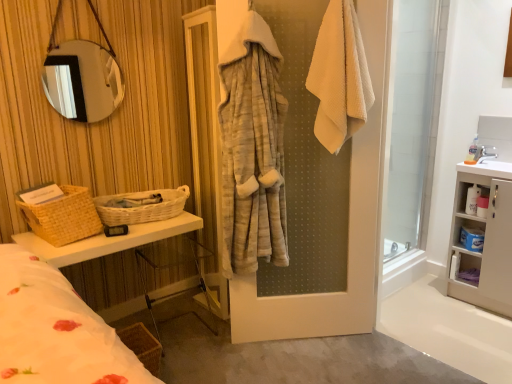
The height and width of the screenshot is (384, 512). Describe the element at coordinates (469, 235) in the screenshot. I see `blue plastic container at right, the second cabinet from the top` at that location.

Where is `white matte cabinet at right`? The height and width of the screenshot is (384, 512). white matte cabinet at right is located at coordinates (484, 239).

What do you see at coordinates (109, 240) in the screenshot? This screenshot has height=384, width=512. I see `woven wicker vanity at left` at bounding box center [109, 240].

How much space does woven beige basket at left, which appears as the third basket when viewed from the right, occupy vertically?

The height of woven beige basket at left, which appears as the third basket when viewed from the right, is 29.34 centimeters.

This screenshot has height=384, width=512. Describe the element at coordinates (83, 81) in the screenshot. I see `silver reflective mirror at upper left` at that location.

This screenshot has width=512, height=384. Describe the element at coordinates (339, 77) in the screenshot. I see `white waffle-textured towel at upper right` at that location.

Locate an element on the screen. This screenshot has width=512, height=384. blue plastic container at right, the second cabinet from the top is located at coordinates (469, 235).

Is white plastic cabinet at right, which ranks as the 1th cabinet in top-to-bottom order, with white waffle-textured towel at upper right?

No, white plastic cabinet at right, which ranks as the 1th cabinet in top-to-bottom order, is not in contact with white waffle-textured towel at upper right.

Is white plastic cabinet at right, which ranks as the 1th cabinet in top-to-bottom order, spatially inside white waffle-textured towel at upper right, or outside of it?

white plastic cabinet at right, which ranks as the 1th cabinet in top-to-bottom order, lies outside white waffle-textured towel at upper right.

Is white waffle-textured towel at upper right at the back of white plastic cabinet at right, which ranks as the 1th cabinet in top-to-bottom order?

No, white plastic cabinet at right, which ranks as the 1th cabinet in top-to-bottom order,'s orientation is not away from white waffle-textured towel at upper right.

What's the angular difference between white waffle-textured towel at upper right and white matte cabinet at right's facing directions?

The angular difference between white waffle-textured towel at upper right and white matte cabinet at right is 53.4 degrees.

Does white waffle-textured towel at upper right contain white matte cabinet at right?

No.

Which object is wider, white waffle-textured towel at upper right or white matte cabinet at right?

white matte cabinet at right is wider.

From a real-world perspective, is white waffle-textured towel at upper right beneath woven wicker vanity at left?

Incorrect, from a real-world perspective, white waffle-textured towel at upper right is higher than woven wicker vanity at left.

Considering the positions of points (359, 88) and (46, 251), is point (359, 88) closer to camera compared to point (46, 251)?

No.

The image size is (512, 384). Identify the location of bathroom cabinet below the white glossy sink at upper right (from a real-world perspective). (484, 239).

Based on their sizes in the image, would you say white glossy sink at upper right is bigger or smaller than white matte cabinet at right?

Considering their sizes, white glossy sink at upper right takes up less space than white matte cabinet at right.

Does white glossy sink at upper right lie behind white matte cabinet at right?

Yes, the depth of white glossy sink at upper right is greater than that of white matte cabinet at right.

From the image's perspective, which one is positioned higher, white glossy sink at upper right or white matte cabinet at right?

From the image's view, white glossy sink at upper right is above.

Considering the positions of point (134, 222) and point (479, 166), is point (134, 222) closer or farther from the camera than point (479, 166)?

Clearly, point (134, 222) is closer to the camera than point (479, 166).

The height and width of the screenshot is (384, 512). In order to click on the 2nd basket counting from the left of the white glossy sink at upper right in this screenshot , I will do `click(144, 208)`.

From a real-world perspective, which object stands above the other?

In real-world perspective, white glossy sink at upper right is above.

From the image's perspective, is woven wicker basket at left, which ranks as the 3th basket in bottom-to-top order, on white glossy sink at upper right?

Incorrect, from the image's perspective, woven wicker basket at left, which ranks as the 3th basket in bottom-to-top order, is lower than white glossy sink at upper right.

Considering the sizes of objects woven wicker vanity at left and silver reflective mirror at upper left in the image provided, who is thinner, woven wicker vanity at left or silver reflective mirror at upper left?

silver reflective mirror at upper left.

Which is less distant, (97, 239) or (58, 91)?

The point (97, 239) is more forward.

Is woven wicker vanity at left looking in the opposite direction of silver reflective mirror at upper left?

No, woven wicker vanity at left is not facing the opposite direction of silver reflective mirror at upper left.

Is white plastic cabinet at right, which ranks as the 1th cabinet in top-to-bottom order, far away from woven beige basket at left, which appears as the third basket when viewed from the right?

Yes, white plastic cabinet at right, which ranks as the 1th cabinet in top-to-bottom order, and woven beige basket at left, which appears as the third basket when viewed from the right, are quite far apart.

Does white plastic cabinet at right, which ranks as the 1th cabinet in top-to-bottom order, have a greater height compared to woven beige basket at left, which appears as the third basket when viewed from the right?

No.

What are the coordinates of `the 1st cabinet located beneath the white waffle-textured towel at upper right (from a real-world perspective)` in the screenshot? It's located at (463, 204).

Where is `bath towel located in front of the white matte cabinet at right`? This screenshot has width=512, height=384. bath towel located in front of the white matte cabinet at right is located at coordinates (339, 77).

Based on their spatial positions, is white matte cabinet at right or white plastic cabinet at right, which is the 2th cabinet from bottom to top, closer to white waffle-textured towel at upper right?

white matte cabinet at right.

From the image, which object appears to be farther from white glossy sink at upper right, woven wicker basket at left, which is counted as the first basket, starting from the top, or white matte cabinet at right?

woven wicker basket at left, which is counted as the first basket, starting from the top.

When comparing their distances from woven wicker vanity at left, does silver reflective mirror at upper left or white plastic cabinet at right, which ranks as the 1th cabinet in top-to-bottom order, seem further?

white plastic cabinet at right, which ranks as the 1th cabinet in top-to-bottom order, is further to woven wicker vanity at left.

From the image, which object appears to be nearer to white waffle-textured towel at upper right, white matte cabinet at right or woven wicker basket at left, which ranks as the 3th basket in bottom-to-top order?

The object closer to white waffle-textured towel at upper right is woven wicker basket at left, which ranks as the 3th basket in bottom-to-top order.

Based on their spatial positions, is woven wicker basket at left, which is counted as the first basket, starting from the top, or transparent glass screen door at right closer to white matte cabinet at right?

transparent glass screen door at right is positioned closer to the anchor white matte cabinet at right.

Looking at the image, which one is located further to white matte cabinet at right, white glossy sink at upper right or white plastic cabinet at right, which is the 2th cabinet from bottom to top?

white glossy sink at upper right lies further to white matte cabinet at right than the other object.

Which object lies nearer to the anchor point white glossy sink at upper right, silver reflective mirror at upper left or woven wicker basket at left, the 2th basket from the right?

woven wicker basket at left, the 2th basket from the right.

Looking at the image, which one is located further to white waffle-textured towel at upper right, woven beige basket at left, the 1th basket positioned from the left, or silver reflective mirror at upper left?

Among the two, woven beige basket at left, the 1th basket positioned from the left, is located further to white waffle-textured towel at upper right.

You are a GUI agent. You are given a task and a screenshot of the screen. Output one action in this format:
    pyautogui.click(x=<x>, y=<y>)
    Task: Click on the basket between woven wicker basket at left, which is counted as the first basket, starting from the top, and white matte cabinet at right from left to right
    Image resolution: width=512 pixels, height=384 pixels.
    Given the screenshot: What is the action you would take?
    pyautogui.click(x=142, y=345)

Where is `screen door situated between woven beige basket at left, which appears as the third basket when viewed from the right, and white matte cabinet at right from left to right`? This screenshot has width=512, height=384. screen door situated between woven beige basket at left, which appears as the third basket when viewed from the right, and white matte cabinet at right from left to right is located at coordinates (413, 124).

Locate an element on the screen. cabinet between transparent glass screen door at right and white matte cabinet at right in the vertical direction is located at coordinates (463, 204).

What are the coordinates of `screen door located between white waffle-textured towel at upper right and white plastic cabinet at right, which ranks as the 1th cabinet in top-to-bottom order, in the left-right direction` in the screenshot? It's located at (413, 124).